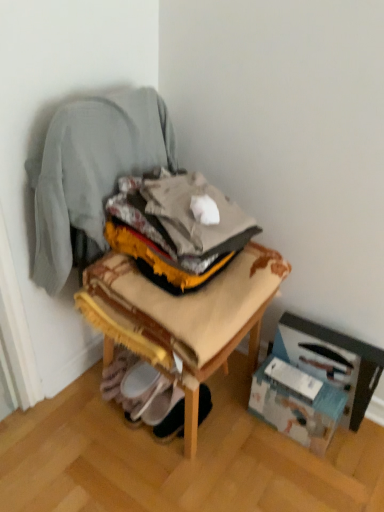
Locate an element on the screen. The width and height of the screenshot is (384, 512). vacant area that lies to the right of white fabric shoe at lower center is located at coordinates (236, 422).